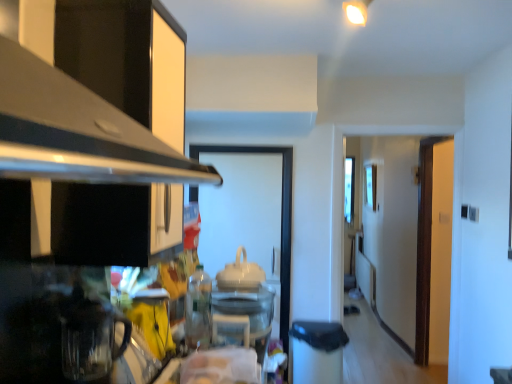
Question: Is transparent glass coffee pot at lower left, the 4th appliance when ordered from right to left, positioned in front of brown wooden door at right?

Choices:
 (A) no
 (B) yes

Answer: (B)

Question: Can brown wooden door at right be found inside transparent glass coffee pot at lower left, the 4th appliance from the back?

Choices:
 (A) no
 (B) yes

Answer: (A)

Question: Is transparent glass coffee pot at lower left, the first appliance viewed from the front, at the left side of brown wooden door at right?

Choices:
 (A) no
 (B) yes

Answer: (B)

Question: Is transparent glass coffee pot at lower left, the first appliance viewed from the left, not near brown wooden door at right?

Choices:
 (A) no
 (B) yes

Answer: (B)

Question: Does transparent glass coffee pot at lower left, the first appliance viewed from the front, have a greater height compared to brown wooden door at right?

Choices:
 (A) no
 (B) yes

Answer: (A)

Question: From a real-world perspective, is white glossy teapot at center, positioned as the 1th appliance in back-to-front order, positioned above or below transparent glass door at center?

Choices:
 (A) below
 (B) above

Answer: (B)

Question: Is point (229, 281) positioned closer to the camera than point (250, 152)?

Choices:
 (A) farther
 (B) closer

Answer: (B)

Question: Considering the relative positions of white glossy teapot at center, positioned as the 1th appliance in back-to-front order, and transparent glass door at center in the image provided, is white glossy teapot at center, positioned as the 1th appliance in back-to-front order, to the left or to the right of transparent glass door at center?

Choices:
 (A) left
 (B) right

Answer: (B)

Question: Looking at their shapes, would you say white glossy teapot at center, which appears as the 4th appliance when viewed from the front, is wider or thinner than transparent glass door at center?

Choices:
 (A) wide
 (B) thin

Answer: (A)

Question: From a real-world perspective, is transparent glass coffee pot at lower left, the 4th appliance when ordered from right to left, physically located above or below yellow matte mug at lower left, placed as the 3th appliance when sorted from back to front?

Choices:
 (A) above
 (B) below

Answer: (A)

Question: Based on their sizes in the image, would you say transparent glass coffee pot at lower left, the 4th appliance when ordered from right to left, is bigger or smaller than yellow matte mug at lower left, which is counted as the 2th appliance, starting from the left?

Choices:
 (A) big
 (B) small

Answer: (A)

Question: From their relative heights in the image, would you say transparent glass coffee pot at lower left, the 4th appliance when ordered from right to left, is taller or shorter than yellow matte mug at lower left, which appears as the 2th appliance when viewed from the front?

Choices:
 (A) tall
 (B) short

Answer: (A)

Question: Is transparent glass coffee pot at lower left, the first appliance viewed from the front, in front of or behind yellow matte mug at lower left, which appears as the 2th appliance when viewed from the front, in the image?

Choices:
 (A) front
 (B) behind

Answer: (A)

Question: Is point (260, 279) closer or farther from the camera than point (436, 162)?

Choices:
 (A) closer
 (B) farther

Answer: (A)

Question: Considering the positions of white glossy teapot at center, which appears as the 4th appliance when viewed from the front, and brown wooden door at right in the image, is white glossy teapot at center, which appears as the 4th appliance when viewed from the front, wider or thinner than brown wooden door at right?

Choices:
 (A) wide
 (B) thin

Answer: (A)